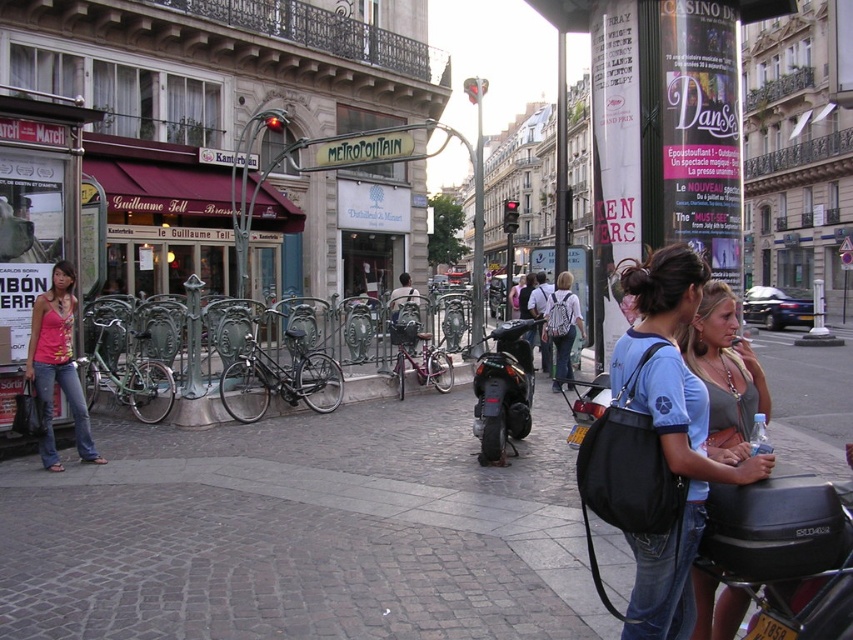
You are a photographer standing at the edge of the sidewalk. You want to take a photo of the matte blue shirt at center without moving any objects. Can you do this from your current position?

The matte blue shirt at center and camera are 3.04 meters apart, so yes, you can take the photo from your current position as the distance is sufficient.

You are a delivery person standing at point (479, 100) and need to deliver a package to point (718, 608). Given that the sidewalk is crowded with pedestrians, which direction should you move to reach your destination?

Since point (718, 608) is in front of point (479, 100), you should move forward in the direction of the motorcycle with the black box attached to its rear to reach your destination.

You are a delivery person who needs to park your black matte bicycle at center in a specific spot. The parking area requires bicycles to be parked within a 10cm radius of the point marked at coordinates 0.589, 0.328. Can you park your bicycle there?

The black matte bicycle at center is already located exactly at the coordinates (279,376), so it is within the required 10cm radius and meets the parking requirement.